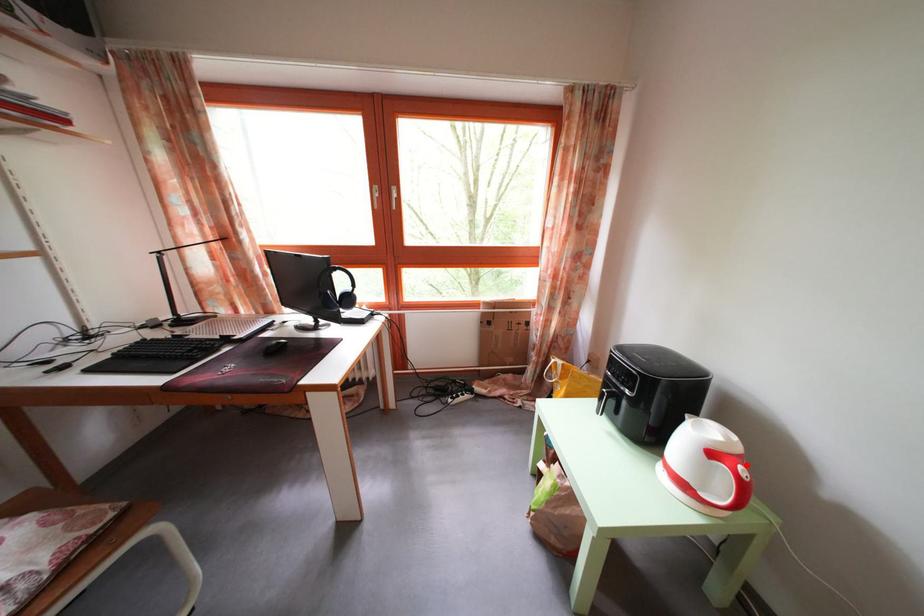
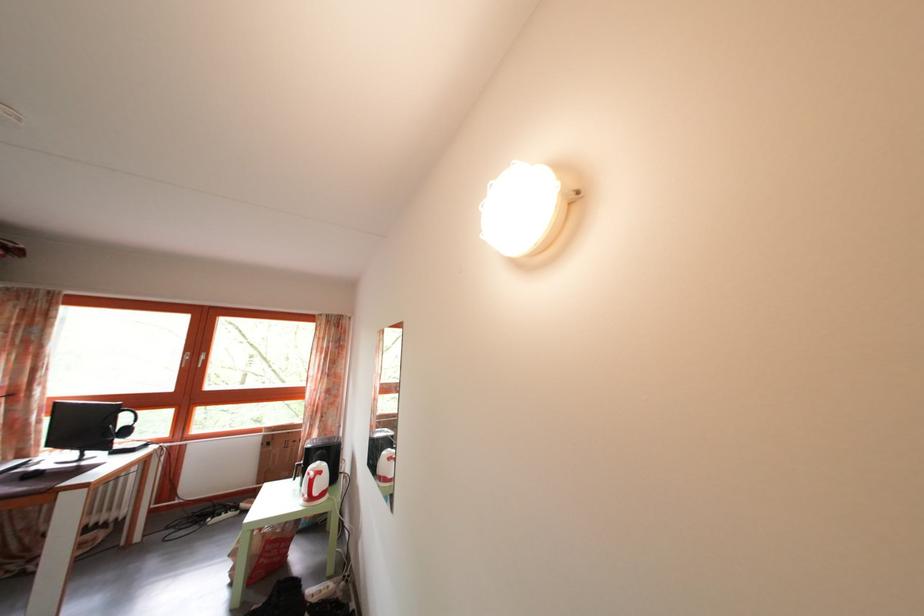
In the second image, find the point that corresponds to the highlighted location in the first image.

(327, 480)